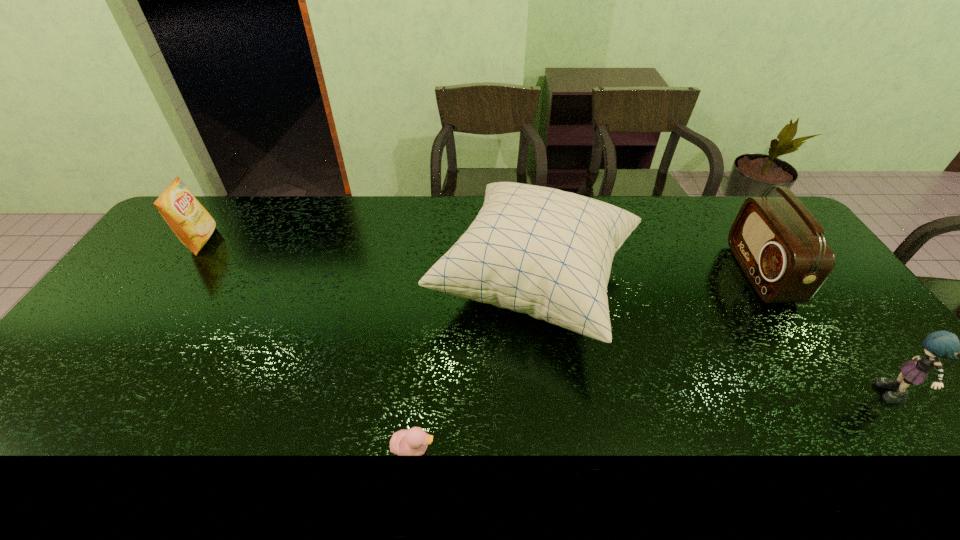
Where is `free space located 0.070m on the front panel of the radio receiver`? This screenshot has width=960, height=540. free space located 0.070m on the front panel of the radio receiver is located at coordinates 720,273.

This screenshot has width=960, height=540. I want to click on free space located 0.100m on the front-facing side of the fourth farthest object, so click(838, 397).

At what (x,y) coordinates should I click in order to perform the action: click on vacant space located 0.380m on the front-facing side of the fourth farthest object. Please return your answer as a coordinate pair (x, y). Looking at the image, I should click on (722, 397).

Identify the location of vacant space located 0.330m on the front-facing side of the fourth farthest object. The height and width of the screenshot is (540, 960). (743, 397).

The width and height of the screenshot is (960, 540). I want to click on vacant position located on the front-facing side of the leftmost object, so click(x=236, y=241).

Locate an element on the screen. This screenshot has height=540, width=960. free space located on the front-facing side of the nearest object is located at coordinates (571, 449).

Find the location of a particular element. The height and width of the screenshot is (540, 960). cushion that is at the far edge is located at coordinates (545, 252).

I want to click on crisp (potato chip) positioned at the far edge, so click(x=193, y=225).

This screenshot has width=960, height=540. I want to click on object located at the near edge, so click(406, 442).

Identify the location of object situated at the left edge. The width and height of the screenshot is (960, 540). (193, 225).